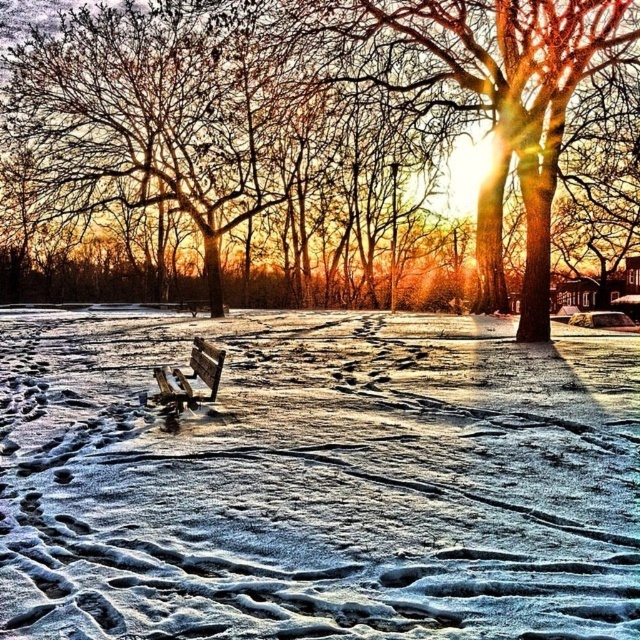
Question: Among these objects, which one is nearest to the camera?

Choices:
 (A) wooden park bench at center
 (B) brown textured tree at center
 (C) white frosty snow at center

Answer: (C)

Question: Which point is closer to the camera?

Choices:
 (A) (145, 396)
 (B) (412, 148)
 (C) (579, 502)

Answer: (C)

Question: Among these objects, which one is nearest to the camera?

Choices:
 (A) white frosty snow at center
 (B) brown textured tree at center
 (C) wooden park bench at center

Answer: (A)

Question: Is white frosty snow at center smaller than wooden park bench at center?

Choices:
 (A) yes
 (B) no

Answer: (B)

Question: Is white frosty snow at center bigger than wooden park bench at center?

Choices:
 (A) no
 (B) yes

Answer: (B)

Question: Does white frosty snow at center lie behind wooden park bench at center?

Choices:
 (A) yes
 (B) no

Answer: (B)